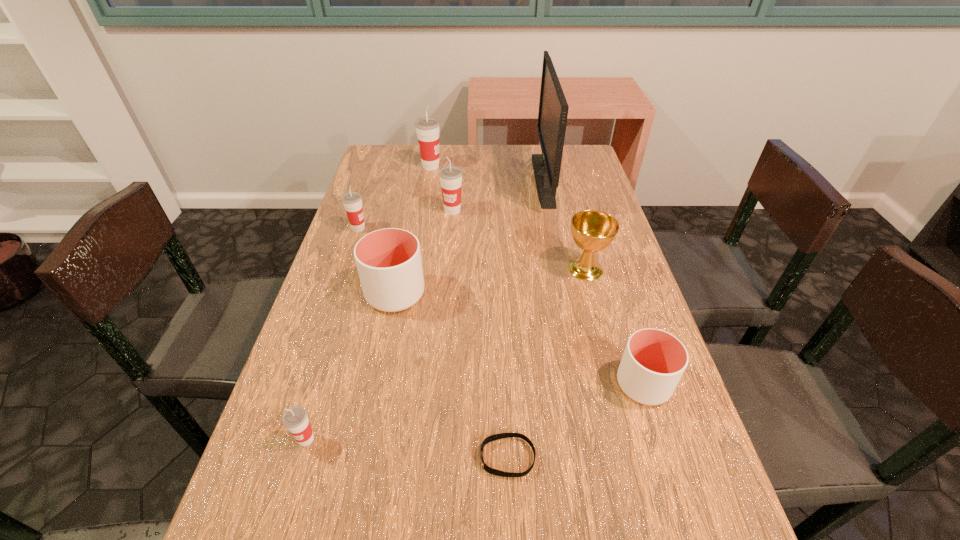
The image size is (960, 540). I want to click on the right white cup, so click(x=653, y=362).

Locate an element on the screen. the nearer white cup is located at coordinates (653, 362).

You are a GUI agent. You are given a task and a screenshot of the screen. Output one action in this format:
    pyautogui.click(x=<x>, y=<y>)
    Task: Click on the nearest cup
    The width and height of the screenshot is (960, 540).
    Given the screenshot: What is the action you would take?
    pyautogui.click(x=295, y=419)

What are the coordinates of `the smallest red cup` in the screenshot? It's located at (295, 419).

You are a GUI agent. You are given a task and a screenshot of the screen. Output one action in this format:
    pyautogui.click(x=<x>, y=<y>)
    Task: Click on the wristband
    This screenshot has width=960, height=540.
    Given the screenshot: What is the action you would take?
    pyautogui.click(x=491, y=438)

Where is `the sixth object from left to right`? Image resolution: width=960 pixels, height=540 pixels. the sixth object from left to right is located at coordinates (491, 438).

I want to click on free space located 0.130m on the front-facing side of the monitor, so click(x=495, y=179).

Locate an element on the screen. vacant area situated on the front-facing side of the monitor is located at coordinates (505, 179).

This screenshot has width=960, height=540. In order to click on vacant area located on the front-facing side of the monitor in this screenshot , I will do `click(495, 179)`.

Where is `vacant area situated on the side of the second red cup from right to left with the logo`? The height and width of the screenshot is (540, 960). vacant area situated on the side of the second red cup from right to left with the logo is located at coordinates (539, 166).